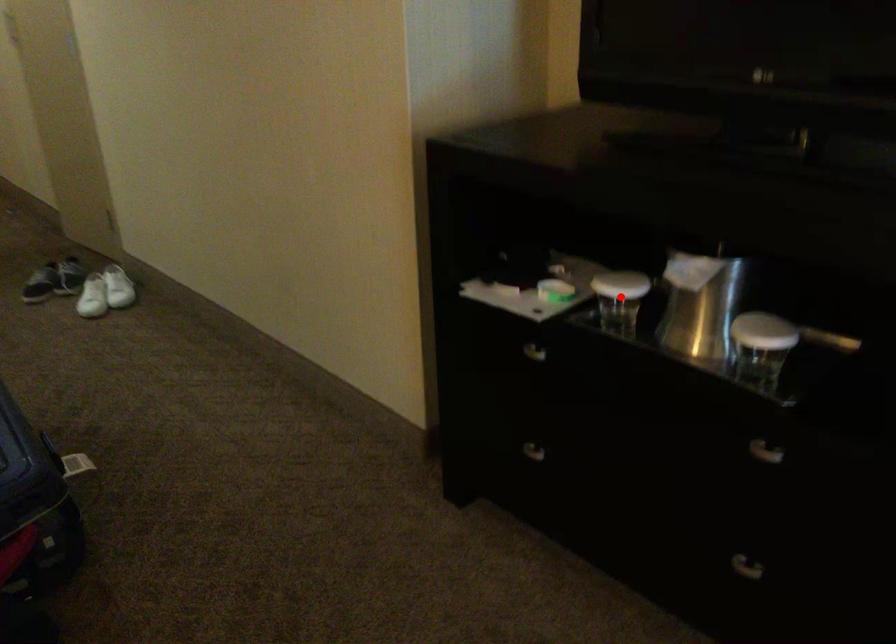
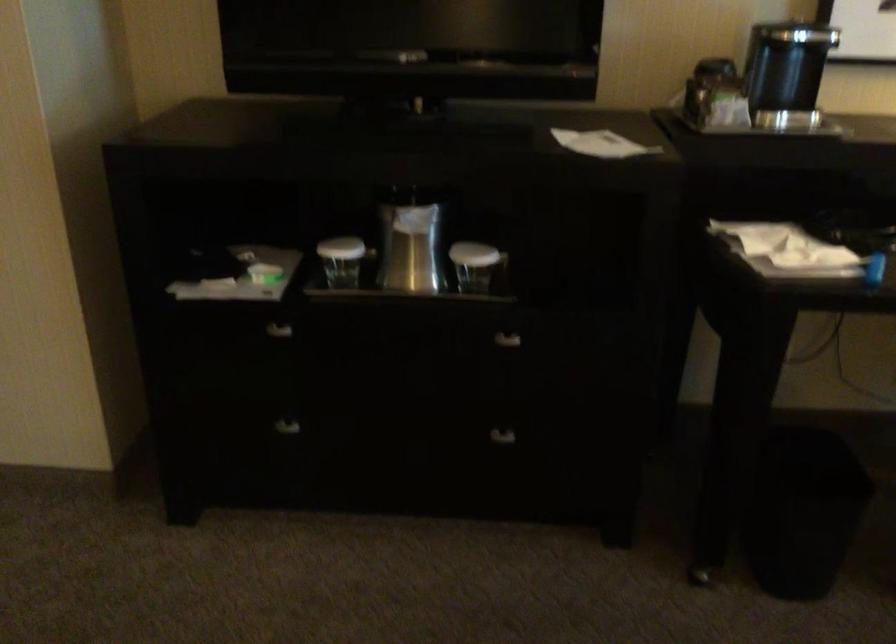
Question: I am providing you with two images of the same scene from different viewpoints. Image1 has a red point marked. In image2, the corresponding 3D location appears at what relative position? Reply with the corresponding letter.

Choices:
 (A) Closer
 (B) Farther

Answer: (B)